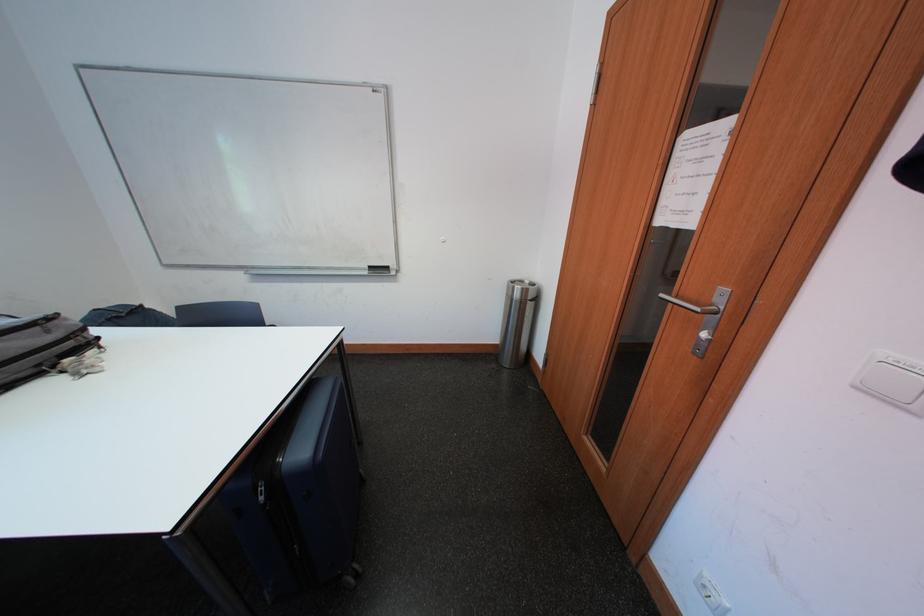
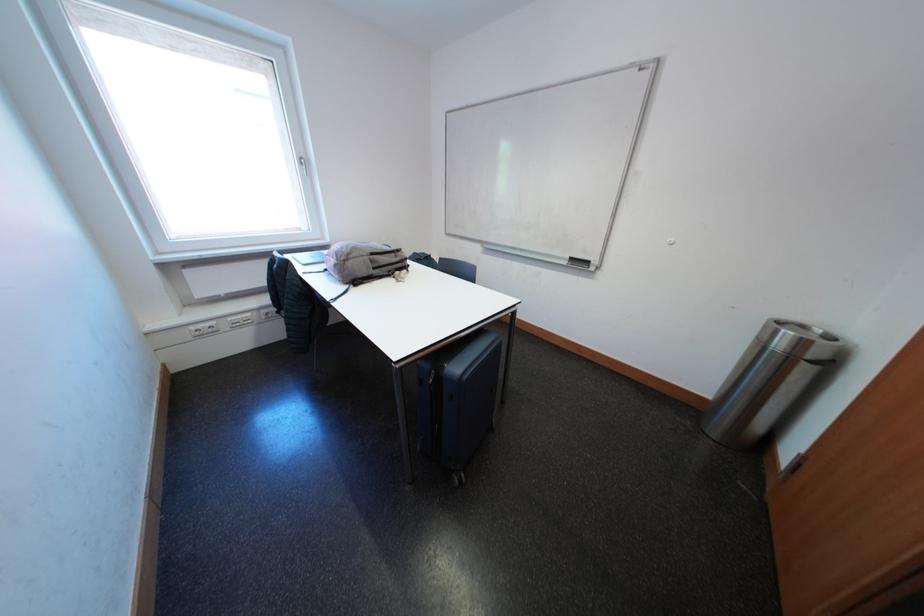
Find the pixel in the second image that matches (375,276) in the first image.

(575, 267)